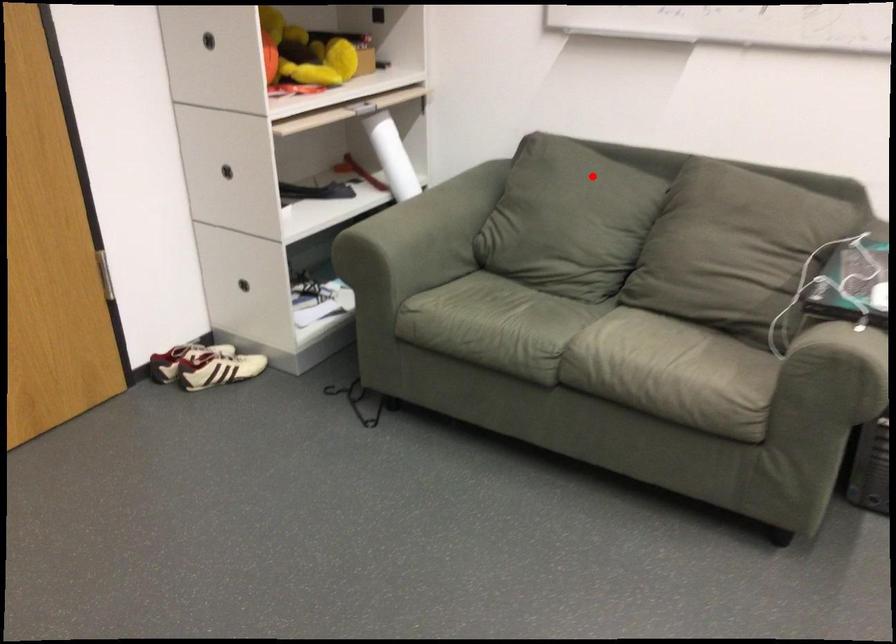
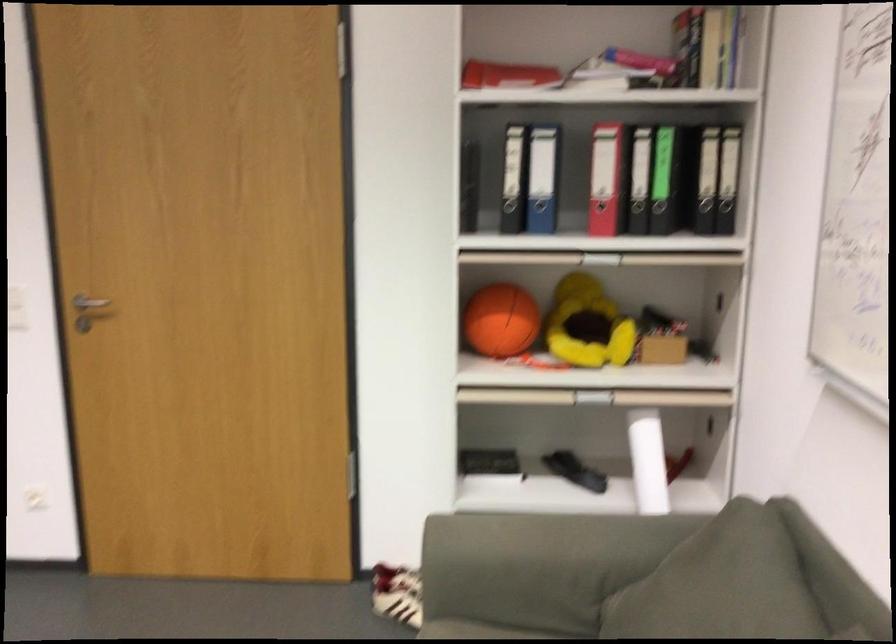
Locate, in the second image, the point that corresponds to the highlighted location in the first image.

(747, 592)